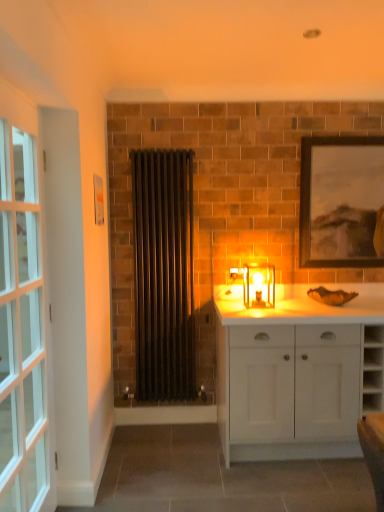
Question: Is translucent glass candle at center positioned behind clear glass door at left?

Choices:
 (A) yes
 (B) no

Answer: (A)

Question: Is translucent glass candle at center outside of clear glass door at left?

Choices:
 (A) yes
 (B) no

Answer: (A)

Question: Considering the relative sizes of translucent glass candle at center and clear glass door at left in the image provided, is translucent glass candle at center thinner than clear glass door at left?

Choices:
 (A) yes
 (B) no

Answer: (B)

Question: Can you confirm if translucent glass candle at center is smaller than clear glass door at left?

Choices:
 (A) no
 (B) yes

Answer: (B)

Question: From the image's perspective, is translucent glass candle at center located beneath clear glass door at left?

Choices:
 (A) no
 (B) yes

Answer: (A)

Question: Is translucent glass candle at center oriented towards clear glass door at left?

Choices:
 (A) no
 (B) yes

Answer: (A)

Question: From the image's perspective, is black metal radiator at center on top of wooden framed artwork at upper right?

Choices:
 (A) no
 (B) yes

Answer: (A)

Question: Is the surface of black metal radiator at center in direct contact with wooden framed artwork at upper right?

Choices:
 (A) yes
 (B) no

Answer: (B)

Question: From a real-world perspective, is black metal radiator at center positioned under wooden framed artwork at upper right based on gravity?

Choices:
 (A) no
 (B) yes

Answer: (B)

Question: Considering the relative sizes of black metal radiator at center and wooden framed artwork at upper right in the image provided, is black metal radiator at center wider than wooden framed artwork at upper right?

Choices:
 (A) no
 (B) yes

Answer: (B)

Question: Does black metal radiator at center appear on the right side of wooden framed artwork at upper right?

Choices:
 (A) yes
 (B) no

Answer: (B)

Question: Are black metal radiator at center and wooden framed artwork at upper right far apart?

Choices:
 (A) yes
 (B) no

Answer: (A)

Question: Is wooden framed artwork at upper right thinner than black metal radiator at center?

Choices:
 (A) yes
 (B) no

Answer: (A)